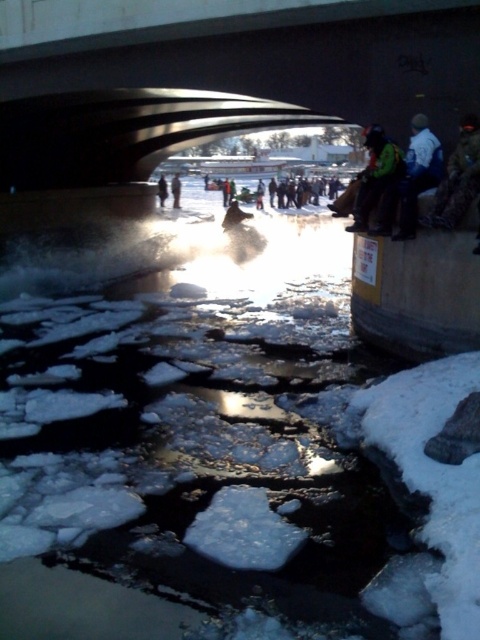
Between green fabric jacket at right and dark blue jacket at center, which one has more height?

Standing taller between the two is dark blue jacket at center.

Which is more to the left, green fabric jacket at right or dark blue jacket at center?

dark blue jacket at center

Locate an element on the screen. The height and width of the screenshot is (640, 480). green fabric jacket at right is located at coordinates (377, 182).

The width and height of the screenshot is (480, 640). What are the coordinates of `green fabric jacket at right` in the screenshot? It's located at (377, 182).

Is dark blue jacket at upper right closer to the viewer compared to dark gray jacket at center?

Yes, it is.

Who is more distant from viewer, (439, 141) or (178, 182)?

The point (178, 182) is behind.

The image size is (480, 640). I want to click on dark blue jacket at upper right, so click(x=418, y=173).

Can you confirm if dark blue jacket at upper right is taller than dark blue jacket at center?

No.

Does dark blue jacket at upper right have a larger size compared to dark blue jacket at center?

Actually, dark blue jacket at upper right might be smaller than dark blue jacket at center.

Between point (396, 236) and point (159, 200), which one is positioned in front?

Positioned in front is point (396, 236).

The image size is (480, 640). Find the location of `dark blue jacket at upper right`. dark blue jacket at upper right is located at coordinates (418, 173).